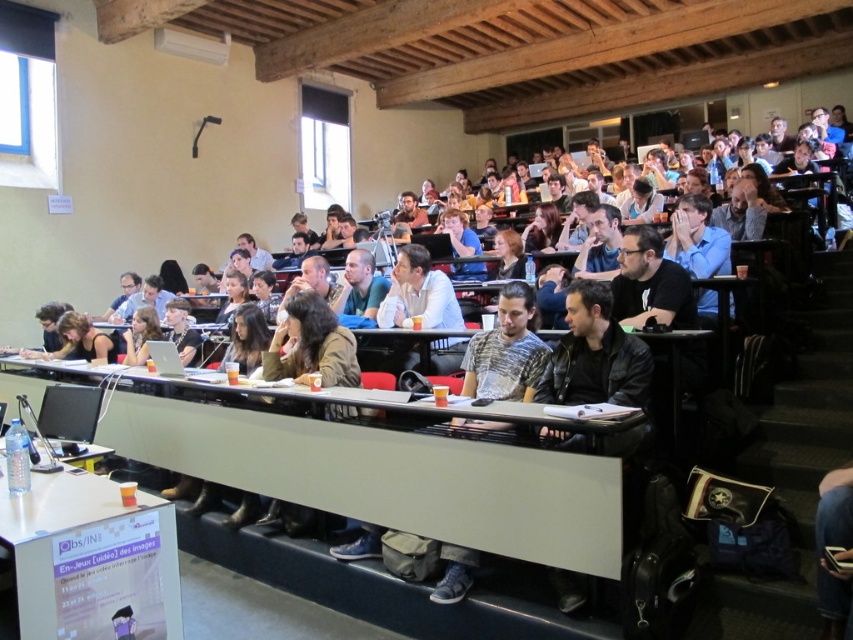
You are a student sitting in the lecture hall and want to pass a note to another student. You are at point (437,516) and they are at point (28,564). Which direction should you throw the note to reach them?

You should throw the note towards the bottom of the image because point (28,564) is closer to the camera than point (437,516).

You are a student sitting at the white plastic table at lower center. You want to place your laptop on the table. What are the coordinates of the table where you should place it?

The white plastic table at lower center is located at coordinates point (389,476).

You are a student carrying a heavy backpack and need to place it on one of the white plastic tables. The backpack requires at least 1 meter of space between the tables to avoid blocking the aisle. Can you safely place it on either the white plastic table at lower center or the white plastic table at lower left?

The white plastic table at lower center is 1.02 meters from the white plastic table at lower left, which meets the required 1 meter of space. Therefore, you can safely place the backpack on either table without blocking the aisle.